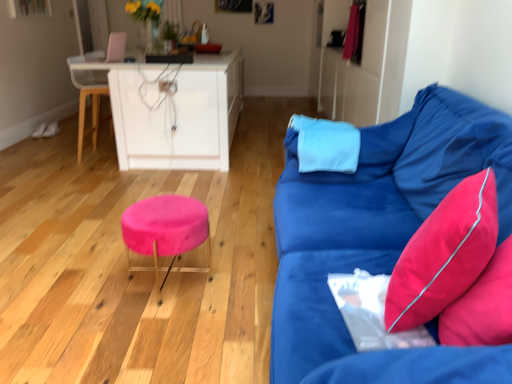
Question: In terms of width, does velvet pink pillow at right, the second pillow from the back, look wider or thinner when compared to velvet pink stool at center?

Choices:
 (A) thin
 (B) wide

Answer: (A)

Question: From a real-world perspective, is velvet pink pillow at right, which ranks as the 1th pillow in bottom-to-top order, positioned above or below velvet pink stool at center?

Choices:
 (A) below
 (B) above

Answer: (B)

Question: Which of these objects is positioned closest to the wooden swivel chair at left?

Choices:
 (A) velvet pink stool at center
 (B) light blue fabric pillow at center, which is the 2th pillow in front-to-back order
 (C) velvet blue couch at right
 (D) velvet pink pillow at right, the second pillow when ordered from top to bottom

Answer: (A)

Question: Estimate the real-world distances between objects in this image. Which object is closer to the light blue fabric pillow at center, which is the 2th pillow in front-to-back order?

Choices:
 (A) velvet blue couch at right
 (B) wooden swivel chair at left
 (C) velvet pink pillow at right, the second pillow when ordered from top to bottom
 (D) velvet pink stool at center

Answer: (A)